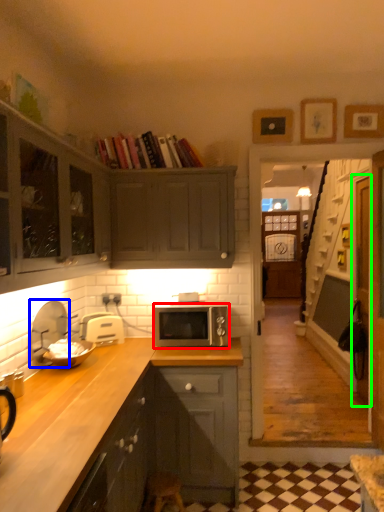
Question: Which object is the closest to the microwave oven (highlighted by a red box)? Choose among these: appliance (highlighted by a blue box) or glass door (highlighted by a green box).

Choices:
 (A) appliance
 (B) glass door

Answer: (A)